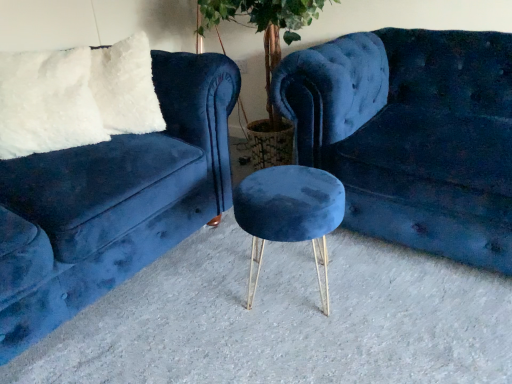
You are a GUI agent. You are given a task and a screenshot of the screen. Output one action in this format:
    pyautogui.click(x=<x>, y=<y>)
    Task: Click on the vacant space in front of velvet blue stool at center
    
    Given the screenshot: What is the action you would take?
    pyautogui.click(x=298, y=344)